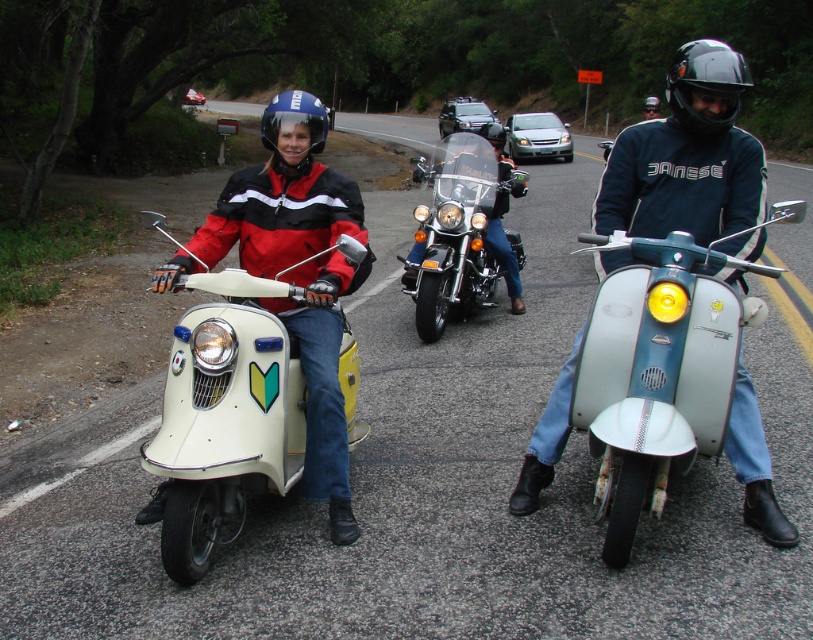
Based on the photo, who is higher up, shiny chrome cruiser at center or black matte goggles at upper center?

Positioned higher is black matte goggles at upper center.

Who is taller, shiny chrome cruiser at center or black matte goggles at upper center?

black matte goggles at upper center is taller.

What do you see at coordinates (462, 234) in the screenshot? I see `shiny chrome cruiser at center` at bounding box center [462, 234].

Where is `shiny chrome cruiser at center`? The image size is (813, 640). shiny chrome cruiser at center is located at coordinates [462, 234].

Is white glossy scooter at center taller than matte black helmet at center?

No, white glossy scooter at center is not taller than matte black helmet at center.

Can you confirm if white glossy scooter at center is positioned to the left of matte black helmet at center?

Yes, white glossy scooter at center is to the left of matte black helmet at center.

Does point (238, 412) come farther from viewer compared to point (498, 145)?

No, it is not.

Image resolution: width=813 pixels, height=640 pixels. In order to click on white glossy scooter at center in this screenshot , I will do `click(225, 416)`.

Which is in front, point (359, 433) or point (314, 108)?

Point (314, 108) is in front.

Between white glossy scooter at center and matte blue helmet at center, which one appears on the left side from the viewer's perspective?

matte blue helmet at center

Is point (298, 388) farther from camera compared to point (320, 147)?

That is False.

Identify the location of white glossy scooter at center. This screenshot has height=640, width=813. (225, 416).